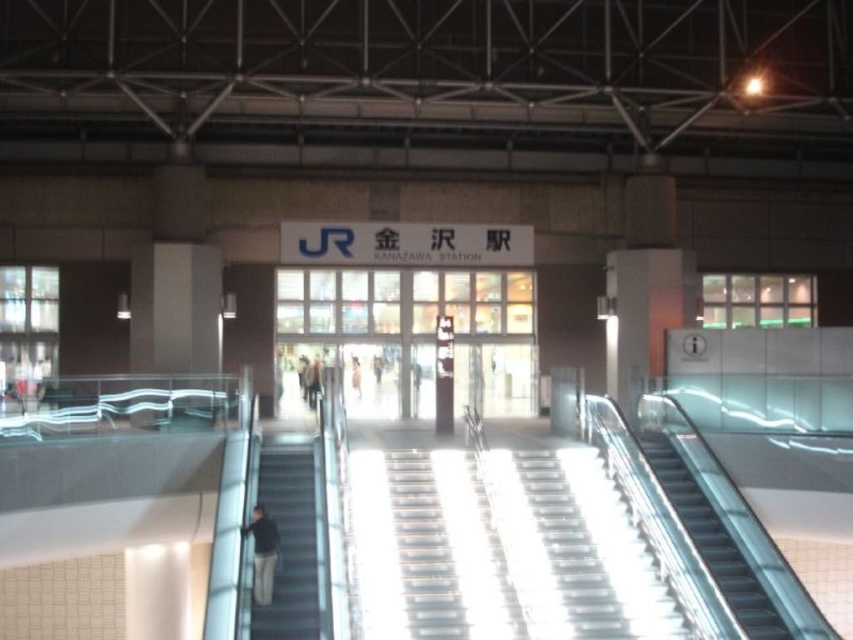
Question: Is metallic escalator at right below dark gray jacket at lower left?

Choices:
 (A) yes
 (B) no

Answer: (A)

Question: Which of the following is the closest to the observer?

Choices:
 (A) metallic gray escalator at lower left
 (B) dark gray jacket at lower left

Answer: (A)

Question: Which point is closer to the camera?

Choices:
 (A) dark gray jacket at lower left
 (B) metallic gray escalator at lower left

Answer: (B)

Question: Is metallic gray escalator at lower left thinner than dark gray jacket at lower left?

Choices:
 (A) no
 (B) yes

Answer: (A)

Question: Is metallic gray escalator at lower left closer to the viewer compared to dark gray jacket at lower left?

Choices:
 (A) yes
 (B) no

Answer: (A)

Question: Which of these objects is positioned closest to the dark gray jacket at lower left?

Choices:
 (A) metallic escalator at right
 (B) metallic gray escalator at lower left

Answer: (B)